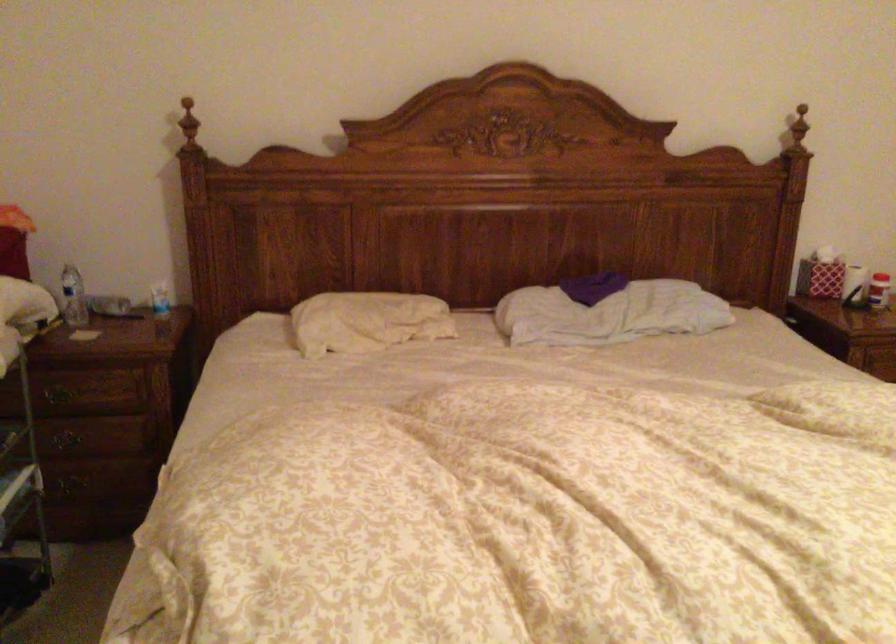
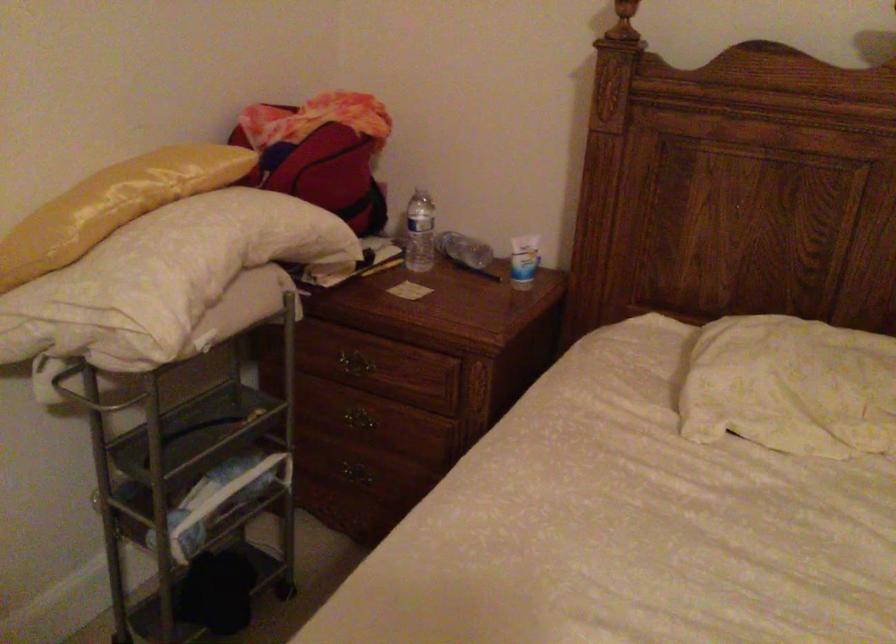
Locate, in the second image, the point that corresponds to the point at 162,299 in the first image.

(523, 261)